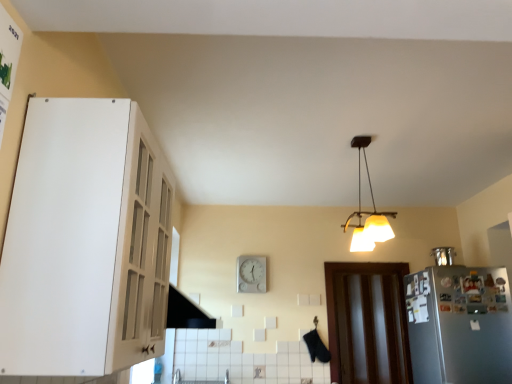
Question: Is white plastic clock at center spatially inside satin silver refrigerator at right, or outside of it?

Choices:
 (A) outside
 (B) inside

Answer: (A)

Question: In terms of width, does white plastic clock at center look wider or thinner when compared to satin silver refrigerator at right?

Choices:
 (A) thin
 (B) wide

Answer: (A)

Question: Which object is positioned farthest from the white glossy cabinet at upper left?

Choices:
 (A) metallic refrigerator at right
 (B) matte yellow lampshade at upper center
 (C) brown wooden door at lower right
 (D) white plastic clock at center
 (E) satin silver refrigerator at right

Answer: (A)

Question: Which is farther from the white glossy cabinet at upper left?

Choices:
 (A) metallic refrigerator at right
 (B) white plastic clock at center
 (C) satin silver refrigerator at right
 (D) matte yellow lampshade at upper center
 (E) brown wooden door at lower right

Answer: (A)